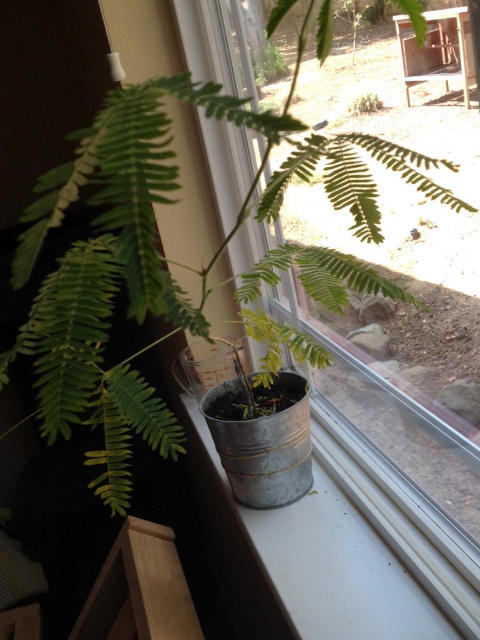
Looking at this image, measure the distance between metallic bucket at center and camera.

metallic bucket at center and camera are 22.30 inches apart.

Which is below, metallic bucket at center or metallic gray window sill at lower left?

Positioned lower is metallic gray window sill at lower left.

At what (x,y) coordinates should I click in order to perform the action: click on metallic bucket at center. Please return your answer as a coordinate pair (x, y). The image size is (480, 640). Looking at the image, I should click on (370, 506).

Where is `metallic bucket at center`? metallic bucket at center is located at coordinates (370, 506).